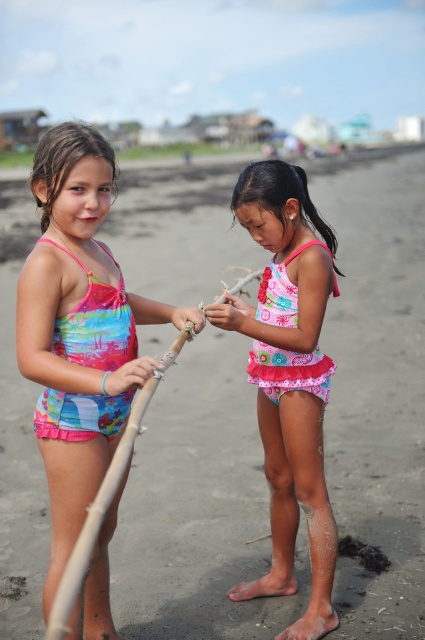
You are a photographer trying to capture both girls in a single frame. Since the multicolored fabric swimsuit at center and pink fabric swimsuit at center are both at the center, which swimsuit will require more space in the frame to accommodate its width?

The multicolored fabric swimsuit at center requires more space in the frame because its width surpasses that of the pink fabric swimsuit at center.

You are a photographer trying to capture the two girls on the beach. You want to focus on the girl at point (82, 173) and the girl at point (275, 481). Which girl will appear larger in the photo?

The girl at point (82, 173) will appear larger in the photo because she is closer to the camera than the girl at point (275, 481).

What are the coordinates of the multicolored fabric swimsuit at center?

The multicolored fabric swimsuit at center is located at coordinates point (79, 330).